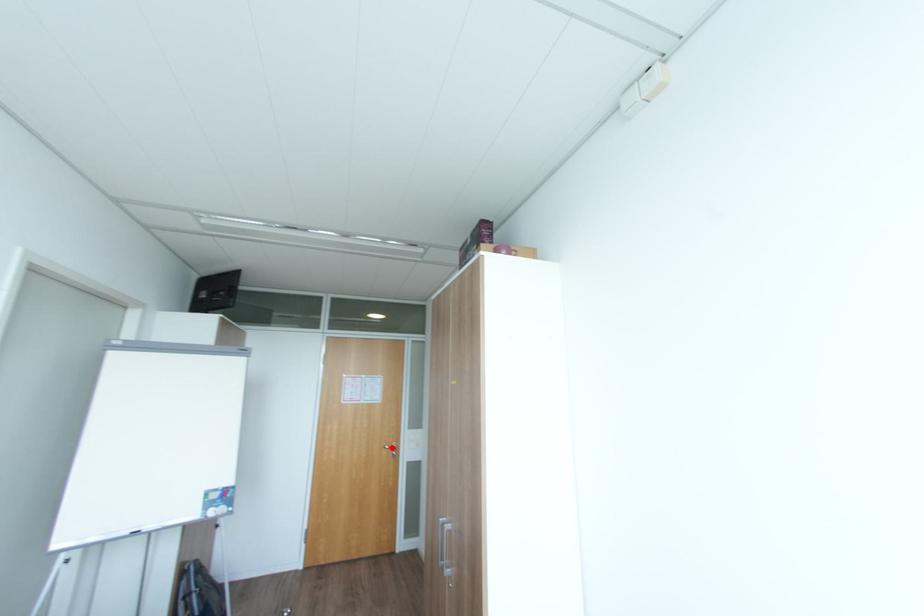
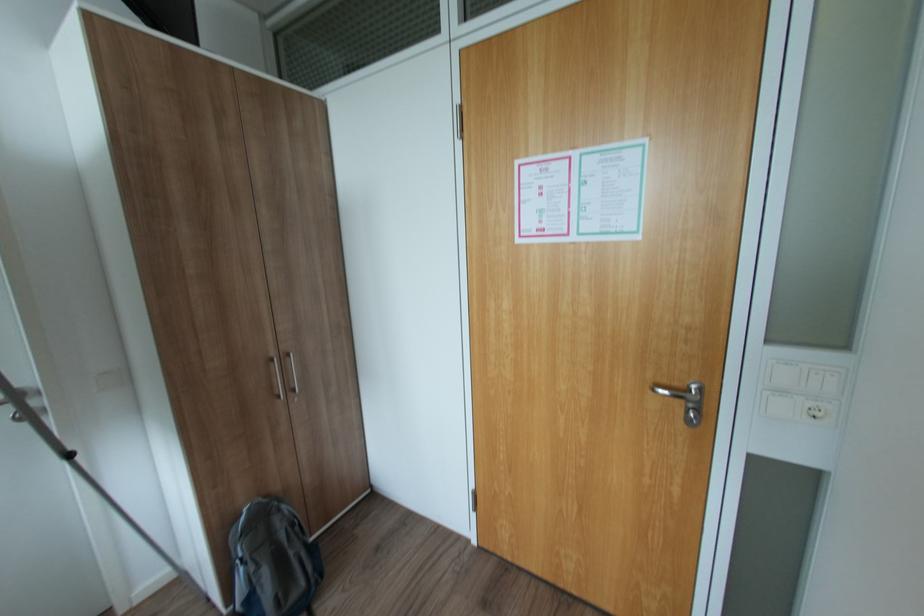
Find the pixel in the second image that matches the highlighted location in the first image.

(664, 390)